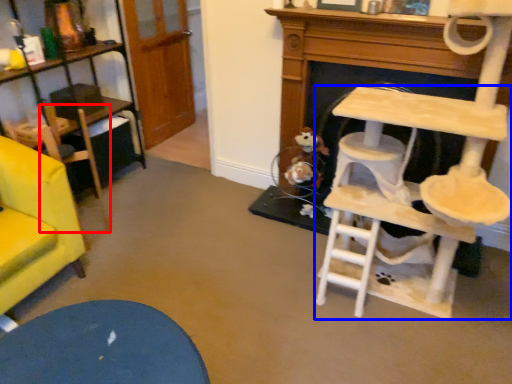
Question: Which point is closer to the camera, armchair (highlighted by a red box) or table (highlighted by a blue box)?

Choices:
 (A) armchair
 (B) table

Answer: (B)